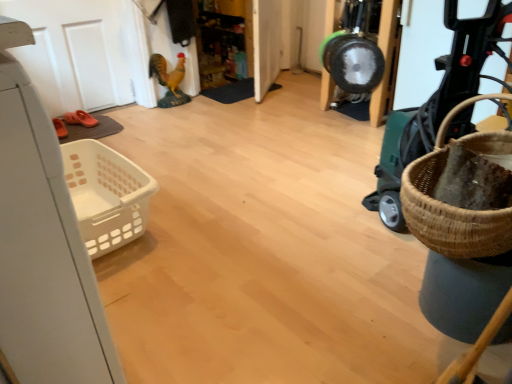
Identify the location of free space between shiny plastic rooster at upper center and green plastic baby carriage at right. This screenshot has height=384, width=512. (271, 158).